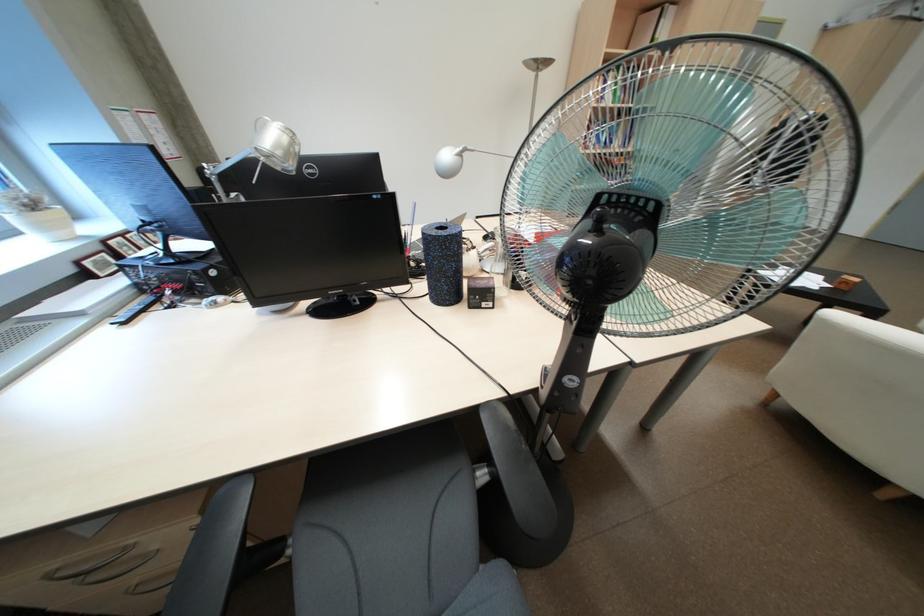
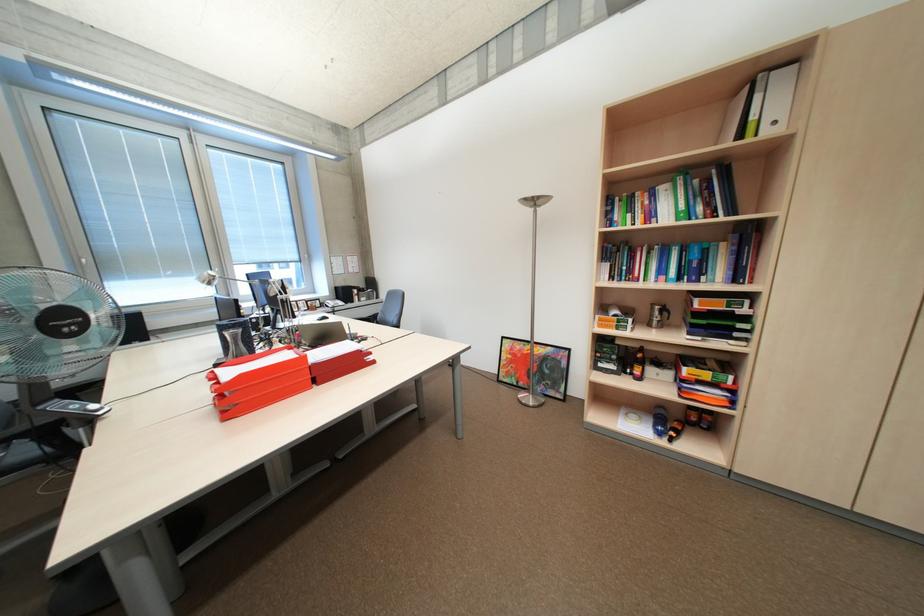
Locate, in the second image, the point that corresponds to [546,65] in the first image.

(542, 203)